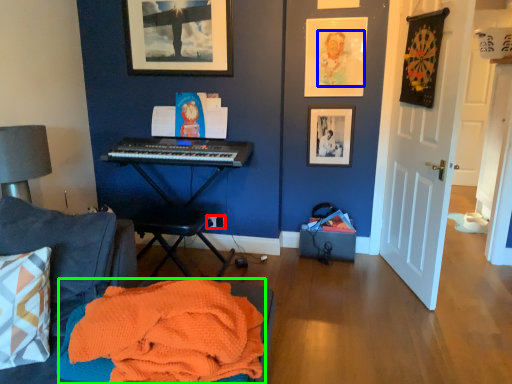
Question: Which object is positioned closest to power outlet (highlighted by a red box)? Select from person (highlighted by a blue box) and blanket (highlighted by a green box).

Choices:
 (A) person
 (B) blanket

Answer: (A)